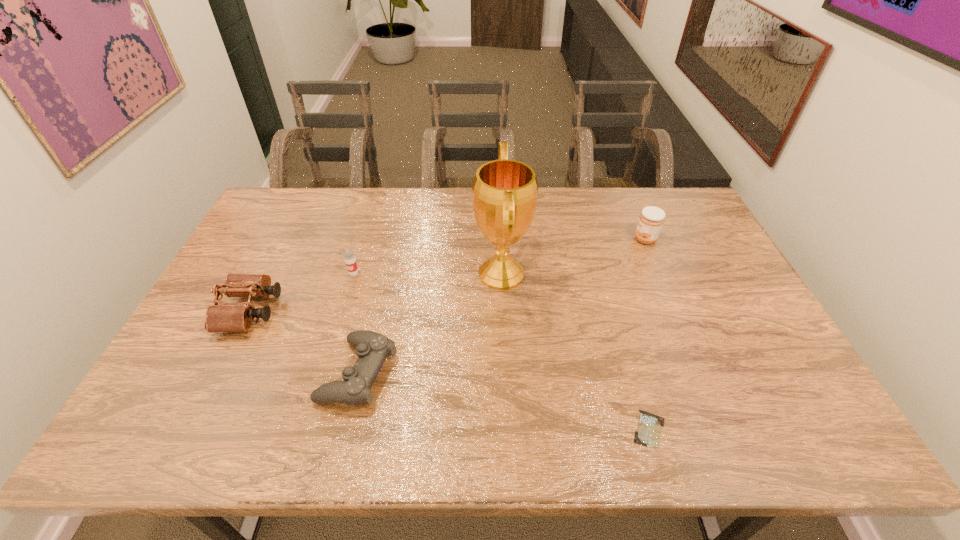
Where is `unoccupied position between the fourth object from left to right and the jam`? unoccupied position between the fourth object from left to right and the jam is located at coordinates (573, 256).

Locate an element on the screen. vacant point located between the jam and the binoculars is located at coordinates (447, 275).

Identify the location of vacant area that lies between the cup and the binoculars. The height and width of the screenshot is (540, 960). (301, 292).

At what (x,y) coordinates should I click in order to perform the action: click on free space between the award and the identity card. Please return your answer as a coordinate pair (x, y). Image resolution: width=960 pixels, height=540 pixels. Looking at the image, I should click on (575, 352).

I want to click on vacant region between the award and the jam, so click(573, 256).

Identify which object is the fourth closest to the rightmost object. Please provide its 2D coordinates. Your answer should be formatted as a tuple, i.e. [(x, y)], where the tuple contains the x and y coordinates of a point satisfying the conditions above.

[(349, 257)]

Image resolution: width=960 pixels, height=540 pixels. Find the location of `object that can be found as the closest to the second object from right to left`. object that can be found as the closest to the second object from right to left is located at coordinates (504, 198).

Where is `blank space that satisfies the following two spatial constraints: 1. through the eyepieces of the shortest object; 2. on the left side of the leftmost object`? blank space that satisfies the following two spatial constraints: 1. through the eyepieces of the shortest object; 2. on the left side of the leftmost object is located at coordinates (191, 429).

Where is `vacant space that satisfies the following two spatial constraints: 1. on the front label of the jam; 2. on the side of the cup with the logo`? vacant space that satisfies the following two spatial constraints: 1. on the front label of the jam; 2. on the side of the cup with the logo is located at coordinates (660, 273).

Locate an element on the screen. blank space that satisfies the following two spatial constraints: 1. on the side of the cup with the logo; 2. on the right side of the control is located at coordinates (324, 373).